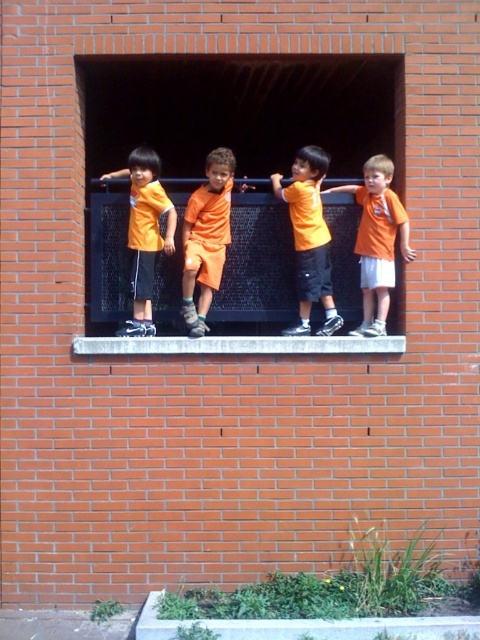
Question: Considering the relative positions of concrete at center and orange matte shirt at right in the image provided, where is concrete at center located with respect to orange matte shirt at right?

Choices:
 (A) left
 (B) right

Answer: (A)

Question: In this image, where is orange matte shirt at right located relative to matte orange shirt at left?

Choices:
 (A) above
 (B) below

Answer: (B)

Question: Can you confirm if orange fabric at center is thinner than orange matte shorts at center?

Choices:
 (A) yes
 (B) no

Answer: (B)

Question: Among these points, which one is nearest to the camera?

Choices:
 (A) (222, 172)
 (B) (297, 262)
 (C) (356, 337)
 (D) (275, 637)

Answer: (D)

Question: Considering the real-world distances, which object is closest to the orange fabric at center?

Choices:
 (A) white stone at center
 (B) concrete at center
 (C) orange matte shirt at right
 (D) orange matte shorts at center

Answer: (C)

Question: Based on their relative distances, which object is nearer to the orange fabric at center?

Choices:
 (A) concrete at center
 (B) orange matte shirt at center
 (C) orange matte shorts at center

Answer: (C)